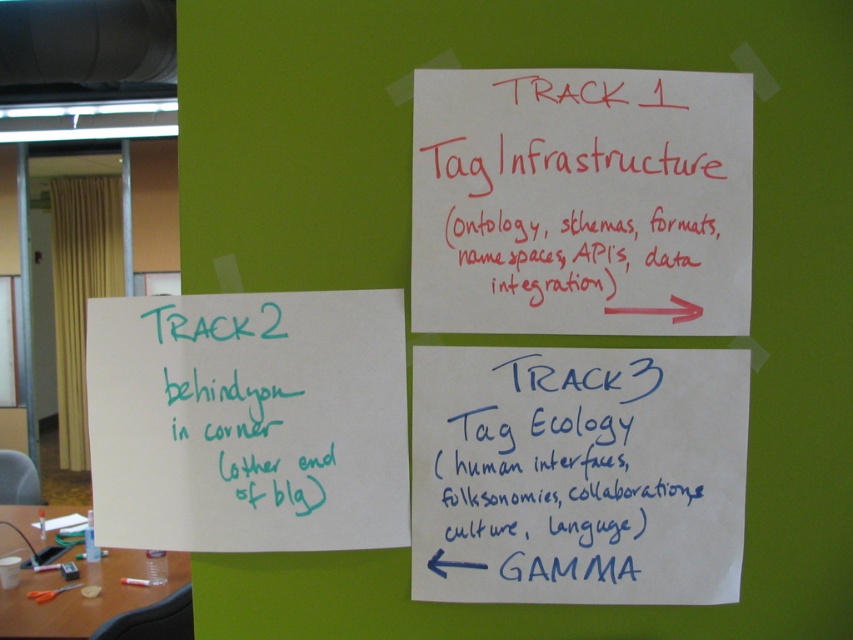
In order to click on white paper at upper center in this screenshot , I will do `click(581, 202)`.

From the picture: Is white paper at upper center smaller than blue handwritten paper at lower right?

Indeed, white paper at upper center has a smaller size compared to blue handwritten paper at lower right.

What do you see at coordinates (581, 202) in the screenshot?
I see `white paper at upper center` at bounding box center [581, 202].

The width and height of the screenshot is (853, 640). Identify the location of white paper at upper center. (581, 202).

Who is positioned more to the right, white paper at upper center or green handwritten note at lower left?

white paper at upper center

Does white paper at upper center have a smaller size compared to green handwritten note at lower left?

Incorrect, white paper at upper center is not smaller in size than green handwritten note at lower left.

Between point (734, 296) and point (285, 496), which one is positioned behind?

The point (734, 296) is more distant.

Locate an element on the screen. The image size is (853, 640). white paper at upper center is located at coordinates (581, 202).

Does blue handwritten paper at lower right lie in front of green handwritten note at lower left?

No, it is not.

Is blue handwritten paper at lower right shorter than green handwritten note at lower left?

No, blue handwritten paper at lower right is not shorter than green handwritten note at lower left.

Is point (453, 600) farther from camera compared to point (184, 304)?

Yes, point (453, 600) is farther from viewer.

The image size is (853, 640). Identify the location of blue handwritten paper at lower right. (563, 476).